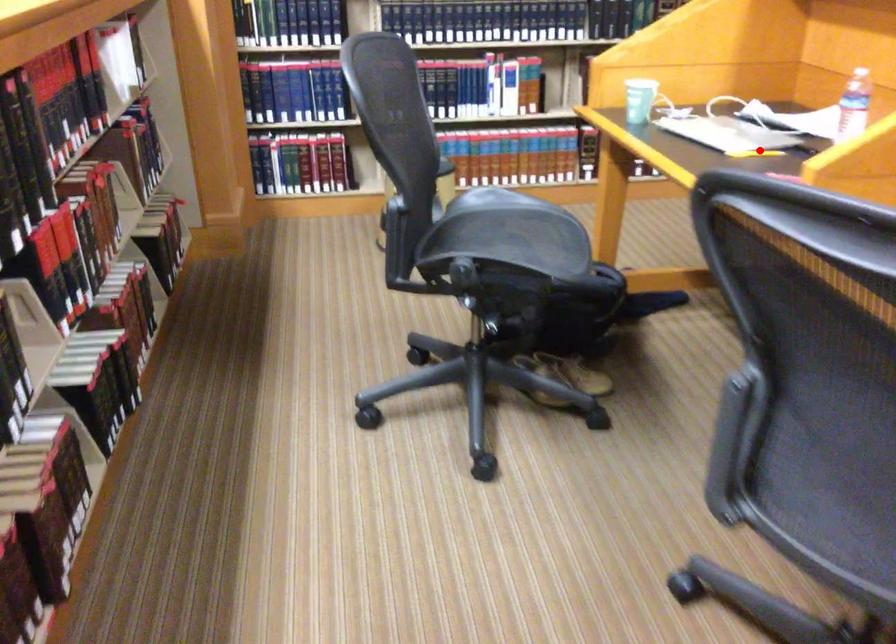
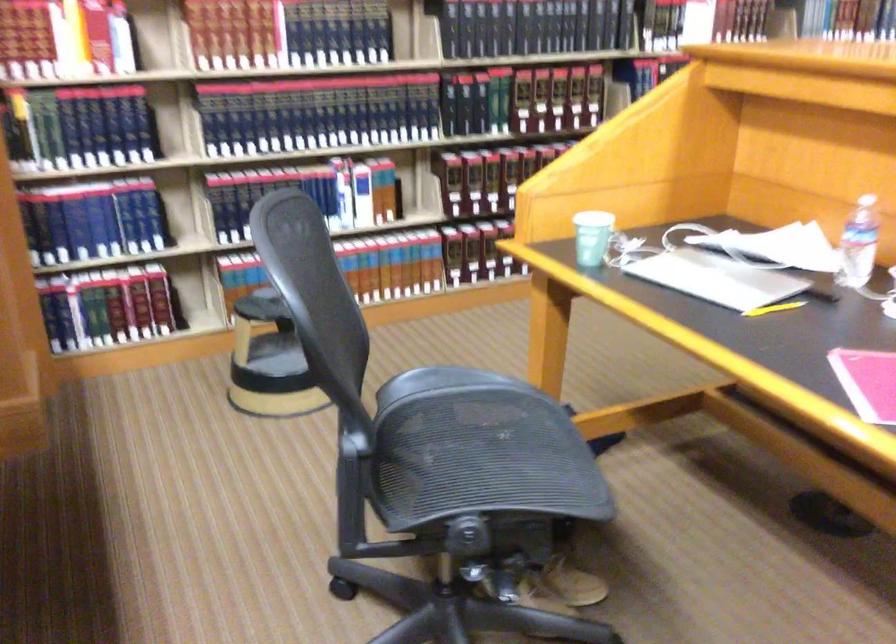
Question: I am providing you with two images of the same scene from different viewpoints. Image1 has a red point marked. In image2, the corresponding 3D location appears at what relative position? Reply with the corresponding letter.

Choices:
 (A) Closer
 (B) Farther

Answer: (A)